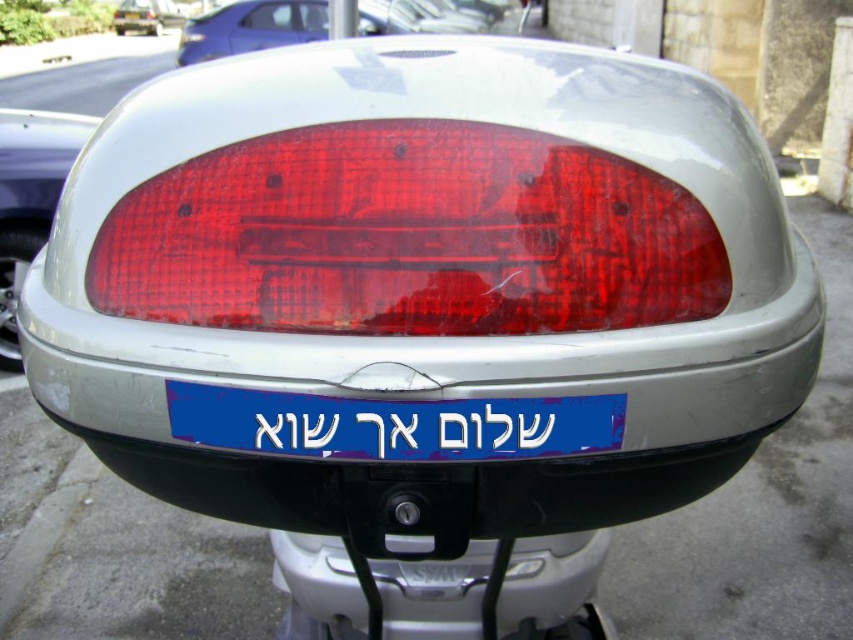
Question: Estimate the real-world distances between objects in this image. Which object is farther from the matte plastic tail light at left?

Choices:
 (A) blue plastic license plate at center
 (B) matte red taillight at upper center
 (C) metallic silver bumper at lower center

Answer: (B)

Question: Is transparent red tail light at center smaller than matte plastic tail light at left?

Choices:
 (A) no
 (B) yes

Answer: (B)

Question: Which point is farther to the camera?

Choices:
 (A) (315, 3)
 (B) (653, 250)
 (C) (606, 620)

Answer: (A)

Question: Does matte plastic tail light at left appear under matte red taillight at upper center?

Choices:
 (A) no
 (B) yes

Answer: (B)

Question: From the image, what is the correct spatial relationship of matte plastic tail light at left in relation to matte red taillight at upper center?

Choices:
 (A) left
 (B) right

Answer: (B)

Question: Which point is closer to the camera?

Choices:
 (A) (193, 29)
 (B) (231, 387)
 (C) (56, 193)

Answer: (B)